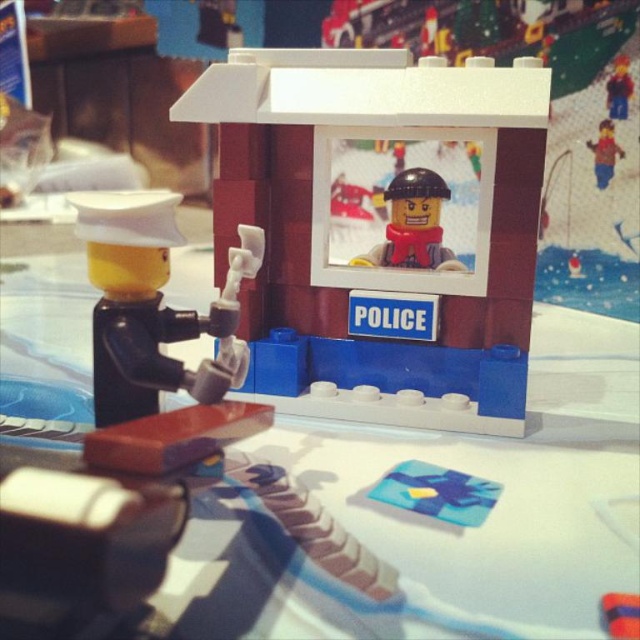
You are a Lego figure trying to reach the matte plastic police booth at center. There is a matte red minifigure at upper right above you. Can you move directly to the booth without climbing anything?

The matte plastic police booth at center is positioned under the matte red minifigure at upper right, so you can move directly to the booth without needing to climb anything because it is below the minifigure.

You are a Lego figure trying to reach the police station. You are standing where the matte black minifigure at left is. Which direction should you move to get to the matte red minifigure at center?

The matte black minifigure at left is located below the matte red minifigure at center, so you should move upward to reach the matte red minifigure at center.

You are a Lego figure trying to reach the blue plastic card at center from the matte plastic police booth at center. The maximum distance you can jump is 30 centimeters. Can you reach the card without moving the booth or the card?

The distance between the matte plastic police booth at center and the blue plastic card at center is 33.13 centimeters, which is beyond your 30 centimeter jump range. You cannot reach the card without moving either object.